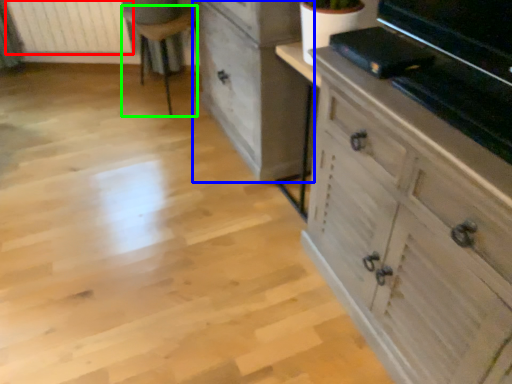
Question: Based on their relative distances, which object is farther from radiator (highlighted by a red box)? Choose from chest of drawers (highlighted by a blue box) and furniture (highlighted by a green box).

Choices:
 (A) chest of drawers
 (B) furniture

Answer: (A)